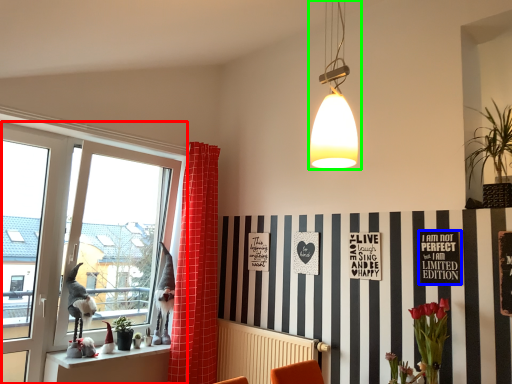
Question: Which object is the farthest from window (highlighted by a red box)? Choose among these: bulletin board (highlighted by a blue box) or lamp (highlighted by a green box).

Choices:
 (A) bulletin board
 (B) lamp

Answer: (A)